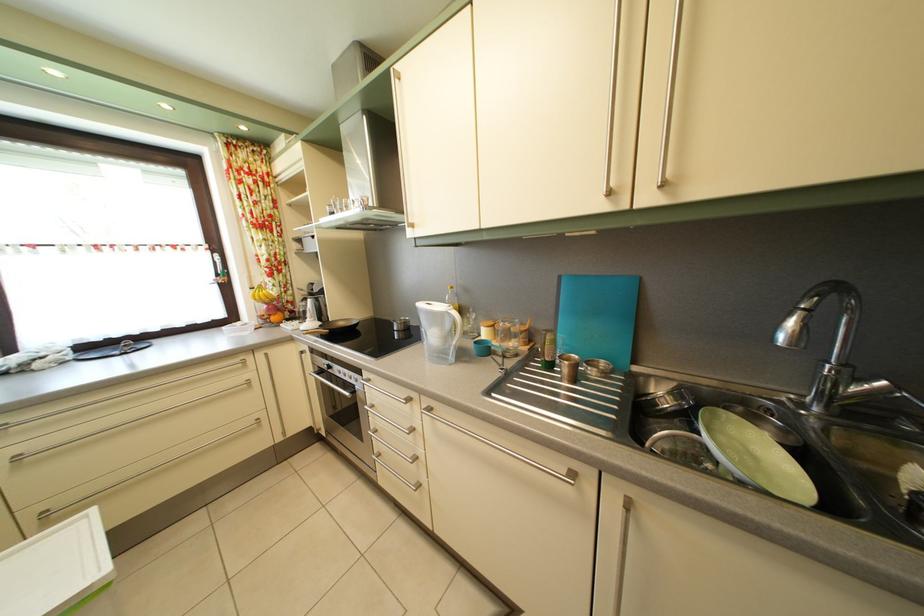
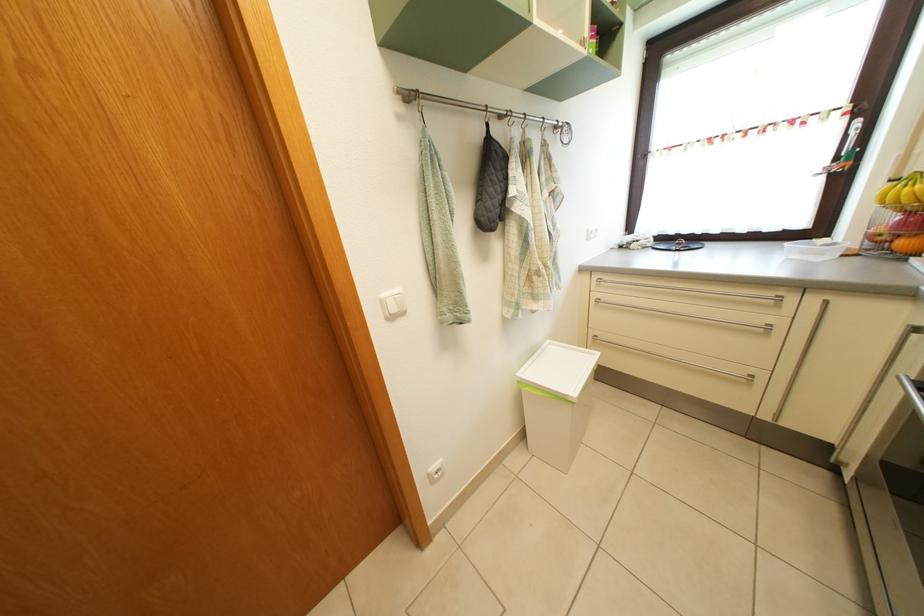
Where in the second image is the point corresponding to the point at 283,326 from the first image?

(910, 252)